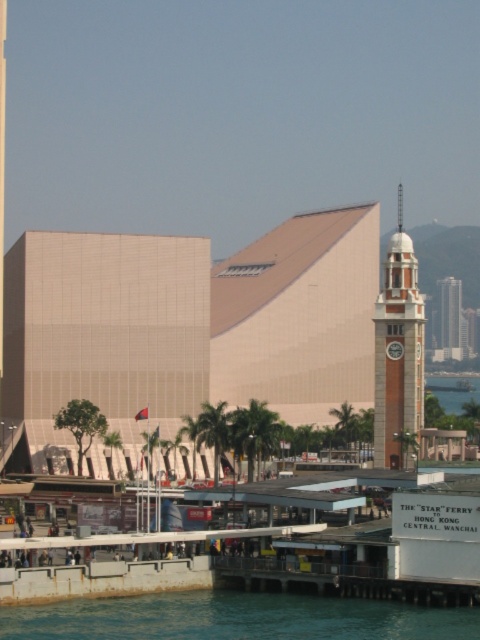
How far apart are red brick clock tower at center and brick red clock tower at center?

They are 61.31 meters apart.

Is point (379, 408) closer to viewer compared to point (445, 289)?

Yes, point (379, 408) is closer to viewer.

Locate an element on the screen. The width and height of the screenshot is (480, 640). red brick clock tower at center is located at coordinates (397, 352).

Which is above, clear blue water at lower left or red brick clock tower at center?

red brick clock tower at center is higher up.

Can you confirm if clear blue water at lower left is positioned above red brick clock tower at center?

No, clear blue water at lower left is not above red brick clock tower at center.

You are a GUI agent. You are given a task and a screenshot of the screen. Output one action in this format:
    pyautogui.click(x=<x>, y=<y>)
    Task: Click on the clear blue water at lower left
    This screenshot has width=480, height=640.
    Given the screenshot: What is the action you would take?
    pyautogui.click(x=235, y=618)

Is clear blue water at lower left further to the viewer compared to brick red clock tower at center?

No, it is not.

I want to click on clear blue water at lower left, so click(x=235, y=618).